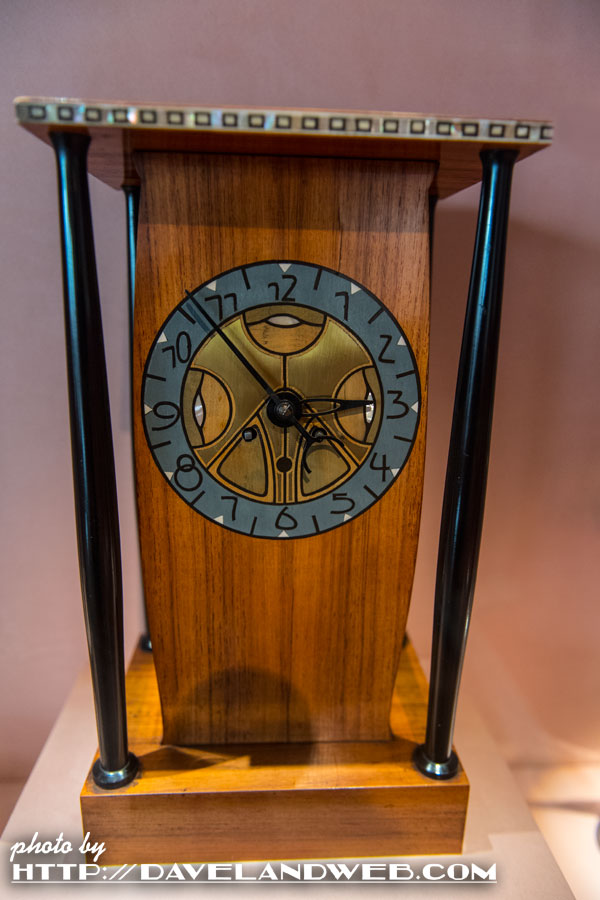
Identify the location of front support pillars of clock. (494, 230), (103, 688).